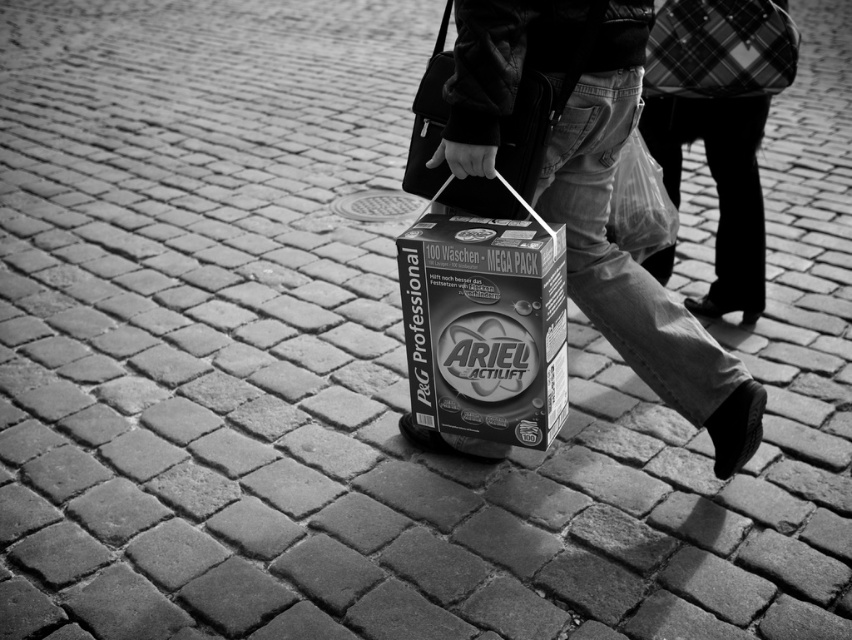
You are a delivery person who just arrived at the scene. You need to hand over the Ariel Professional MEGA PACK to the recipient. Which box should you approach first, the matte cardboard box at center or the matte black cardboard box at center?

You should approach the matte cardboard box at center first because it is closer to you than the matte black cardboard box at center.